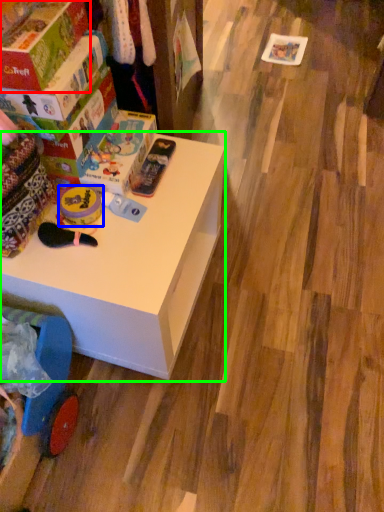
Question: Based on their relative distances, which object is nearer to box (highlighted by a red box)? Choose from toy (highlighted by a blue box) and table (highlighted by a green box).

Choices:
 (A) toy
 (B) table

Answer: (A)